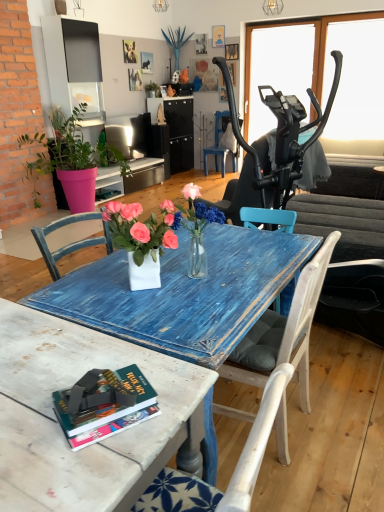
Where is `blank space situated above white distressed wood table at center (from a real-world perspective)`? blank space situated above white distressed wood table at center (from a real-world perspective) is located at coordinates (43, 377).